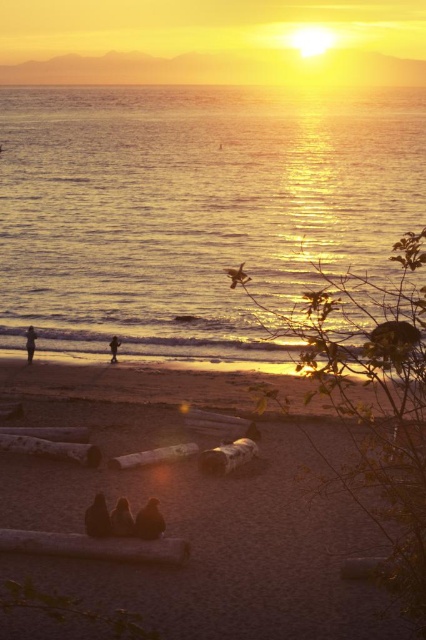
You are a photographer trying to capture the sunset scene. You notice the dark brown fur at center and the silhouette human at center. Which object is positioned higher in the image?

The dark brown fur at center is above the silhouette human at center in the image.